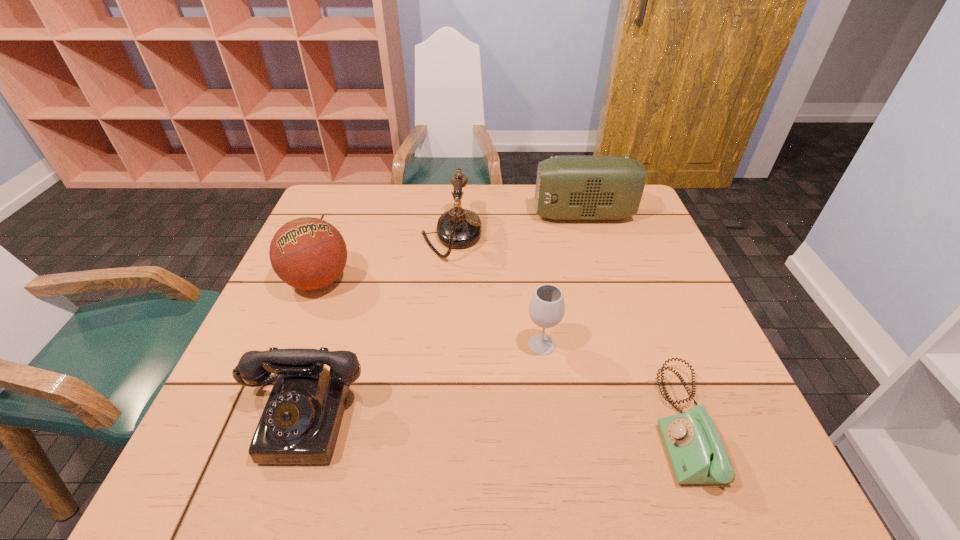
The image size is (960, 540). I want to click on empty space that is in between the third nearest object and the basketball, so click(430, 313).

The height and width of the screenshot is (540, 960). Identify the location of the second closest object to the wineglass. (457, 228).

The height and width of the screenshot is (540, 960). Find the location of `object that stands as the closest to the wineglass`. object that stands as the closest to the wineglass is located at coordinates (697, 455).

Choose which telephone is the nearest neighbor to the leftmost telephone. Please provide its 2D coordinates. Your answer should be formatted as a tuple, i.e. [(x, y)], where the tuple contains the x and y coordinates of a point satisfying the conditions above.

[(457, 228)]

Where is `telephone that stands as the third closest to the wineglass`? telephone that stands as the third closest to the wineglass is located at coordinates (300, 423).

This screenshot has height=540, width=960. What are the coordinates of `free spot that satisfies the following two spatial constraints: 1. on the dial of the third object from left to right; 2. on the dial of the leftmost telephone` in the screenshot? It's located at (437, 417).

Where is `vacant region that satisfies the following two spatial constraints: 1. on the front side of the basketball; 2. on the left side of the wineglass`? The image size is (960, 540). vacant region that satisfies the following two spatial constraints: 1. on the front side of the basketball; 2. on the left side of the wineglass is located at coordinates (292, 345).